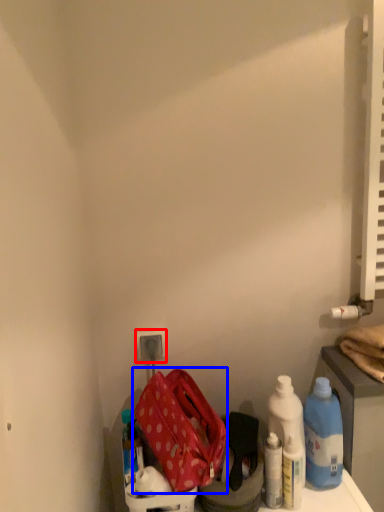
Question: Which object appears closest to the camera in this image, electric outlet (highlighted by a red box) or kit (highlighted by a blue box)?

Choices:
 (A) electric outlet
 (B) kit

Answer: (B)